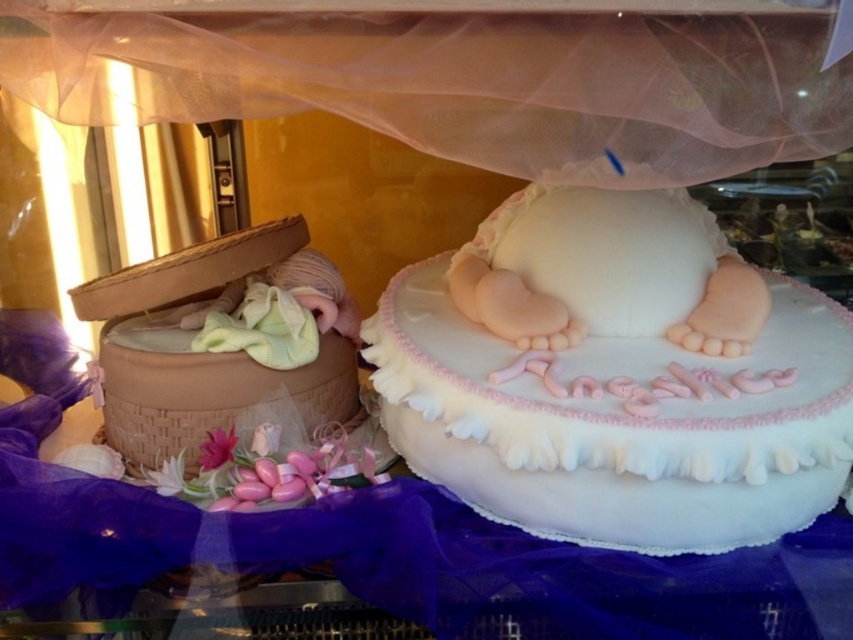
Looking at this image, you are a customer at the bakery and want to place a small gift card next to the braided wicker basket at left and the pink matte flower at lower left. Where should you place it so that it doesn

The braided wicker basket at left is much taller than the pink matte flower at lower left, so placing the gift card next to the pink matte flower at lower left would ensure it is visible and not blocked by the taller basket.

You are a baker who needs to decide whether to place the white fondant cake at center into the braided wicker basket at left. Based on their sizes, will the cake fit inside the basket?

The white fondant cake at center is bigger than the braided wicker basket at left, so it will not fit inside the basket.

You are a customer in a bakery and see the white fondant cake at center and the braided wicker basket at left. Which item is positioned to the right side of the other?

The white fondant cake at center is to the right of the braided wicker basket at left according to the description.